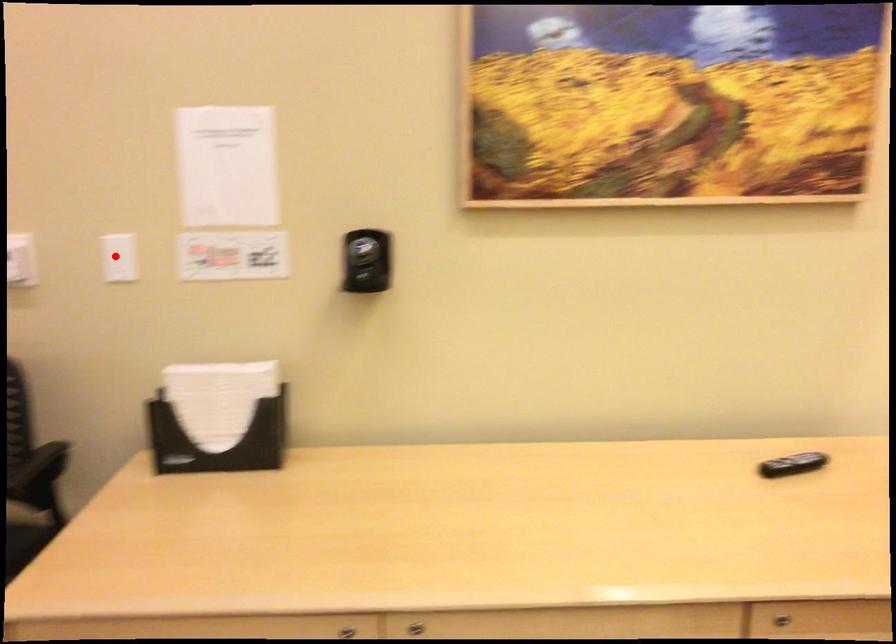
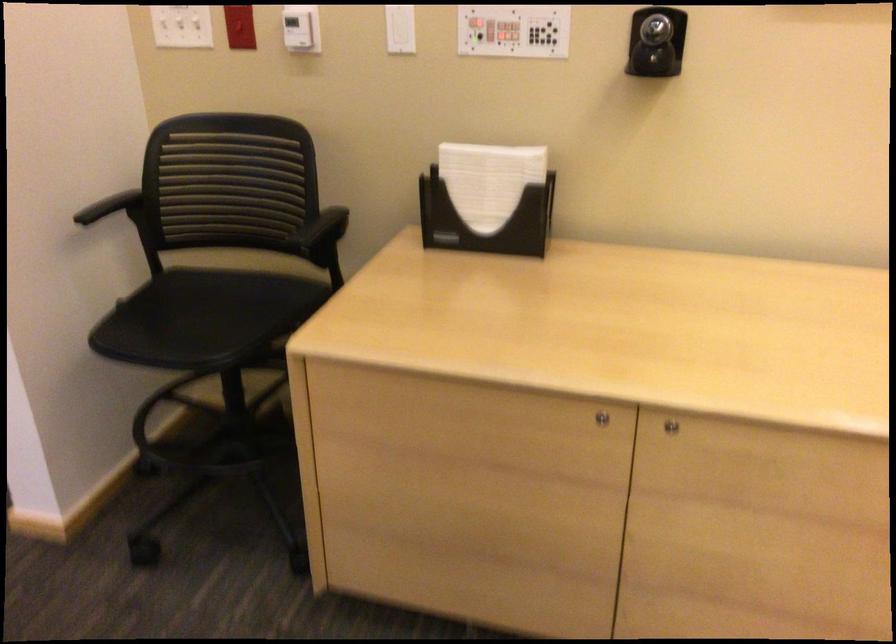
Where in the second image is the point corresponding to the highlighted location from the first image?

(400, 29)